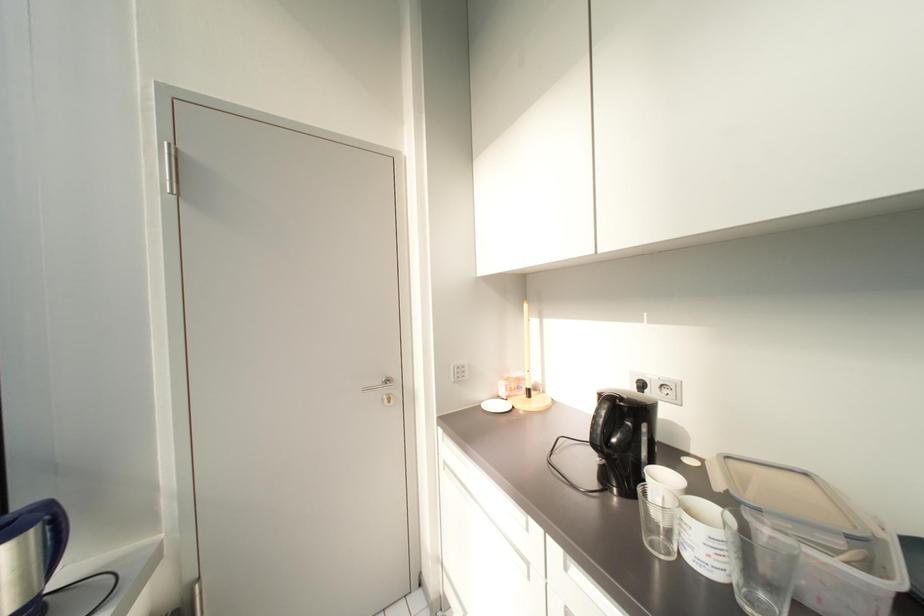
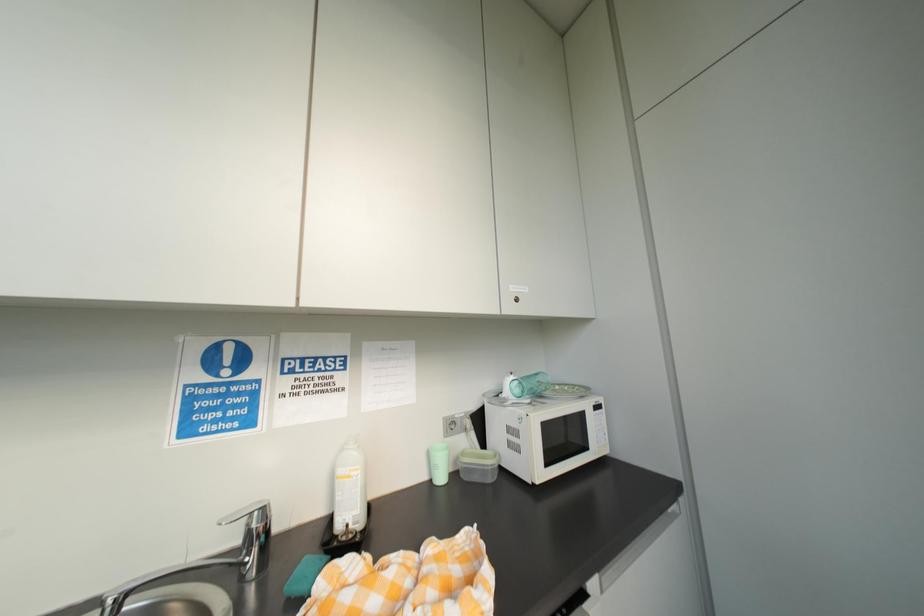
Question: The first image is from the beginning of the video and the second image is from the end. How did the camera likely rotate when shooting the video?

Choices:
 (A) Left
 (B) Right
 (C) Up
 (D) Down

Answer: (B)